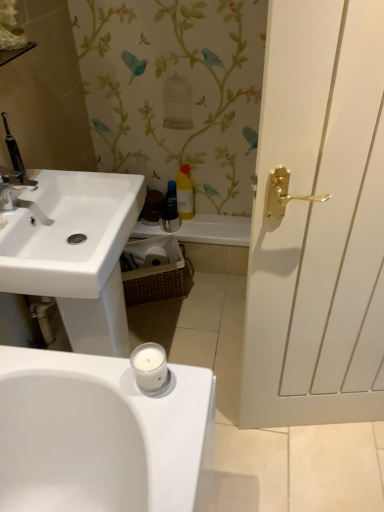
The width and height of the screenshot is (384, 512). I want to click on vacant area to the right of translucent plastic bottle at center, which ranks as the 1th toiletry in left-to-right order, so click(x=214, y=220).